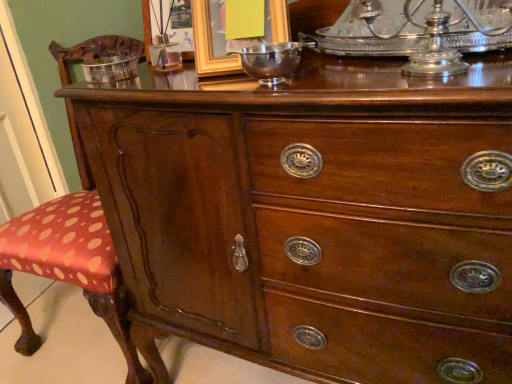
Question: Can you confirm if silver metallic bowl at upper left is smaller than metallic gold picture frame at upper center, which is the first picture frame in left-to-right order?

Choices:
 (A) yes
 (B) no

Answer: (A)

Question: Is silver metallic bowl at upper left positioned beyond the bounds of metallic gold picture frame at upper center, which is the first picture frame in left-to-right order?

Choices:
 (A) yes
 (B) no

Answer: (A)

Question: Are silver metallic bowl at upper left and metallic gold picture frame at upper center, the second picture frame from the right, far apart?

Choices:
 (A) yes
 (B) no

Answer: (B)

Question: Is silver metallic bowl at upper left further to the viewer compared to metallic gold picture frame at upper center, which is the first picture frame in left-to-right order?

Choices:
 (A) yes
 (B) no

Answer: (B)

Question: Is silver metallic bowl at upper left closer to the viewer compared to metallic gold picture frame at upper center, the second picture frame from the right?

Choices:
 (A) no
 (B) yes

Answer: (B)

Question: Does silver metallic bowl at upper left have a greater width compared to metallic gold picture frame at upper center, the second picture frame from the right?

Choices:
 (A) no
 (B) yes

Answer: (B)

Question: Is gold metallic picture frame at upper center, acting as the 2th picture frame starting from the left, looking in the opposite direction of metallic gold picture frame at upper center, the second picture frame from the right?

Choices:
 (A) yes
 (B) no

Answer: (B)

Question: Considering the relative positions of gold metallic picture frame at upper center, arranged as the 1th picture frame when viewed from the right, and metallic gold picture frame at upper center, which is the first picture frame in left-to-right order, in the image provided, is gold metallic picture frame at upper center, arranged as the 1th picture frame when viewed from the right, to the left of metallic gold picture frame at upper center, which is the first picture frame in left-to-right order, from the viewer's perspective?

Choices:
 (A) yes
 (B) no

Answer: (B)

Question: Is gold metallic picture frame at upper center, arranged as the 1th picture frame when viewed from the right, outside of metallic gold picture frame at upper center, which is the first picture frame in left-to-right order?

Choices:
 (A) yes
 (B) no

Answer: (A)

Question: Can you confirm if gold metallic picture frame at upper center, acting as the 2th picture frame starting from the left, is thinner than metallic gold picture frame at upper center, the second picture frame from the right?

Choices:
 (A) yes
 (B) no

Answer: (B)

Question: Considering the relative positions of gold metallic picture frame at upper center, arranged as the 1th picture frame when viewed from the right, and metallic gold picture frame at upper center, the second picture frame from the right, in the image provided, is gold metallic picture frame at upper center, arranged as the 1th picture frame when viewed from the right, to the right of metallic gold picture frame at upper center, the second picture frame from the right, from the viewer's perspective?

Choices:
 (A) no
 (B) yes

Answer: (B)

Question: From a real-world perspective, is gold metallic picture frame at upper center, arranged as the 1th picture frame when viewed from the right, over metallic gold picture frame at upper center, which is the first picture frame in left-to-right order?

Choices:
 (A) yes
 (B) no

Answer: (A)

Question: Can you confirm if shiny silver bowl at center is shorter than silver metallic bowl at upper left?

Choices:
 (A) no
 (B) yes

Answer: (A)